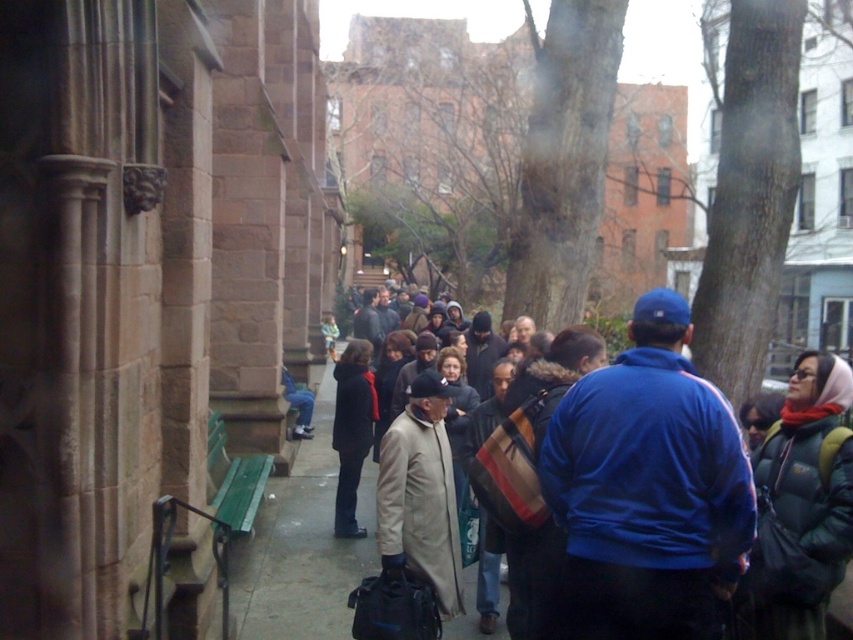
Does dark blue jacket at center have a lesser height compared to dark gray wool coat at center?

Incorrect, dark blue jacket at center's height does not fall short of dark gray wool coat at center's.

Is point (848, 520) positioned before point (352, 342)?

Yes.

Describe the element at coordinates (619, 481) in the screenshot. I see `dark blue jacket at center` at that location.

I want to click on dark blue jacket at center, so click(x=619, y=481).

Is light gray concrete sidewalk at center positioned at the back of dark gray wool coat at center?

No, light gray concrete sidewalk at center is in front of dark gray wool coat at center.

This screenshot has width=853, height=640. What are the coordinates of `light gray concrete sidewalk at center` in the screenshot? It's located at [305, 547].

Looking at this image, does dark blue jacket at center appear under light gray concrete sidewalk at center?

Actually, dark blue jacket at center is above light gray concrete sidewalk at center.

In the scene shown: Between dark blue jacket at center and light gray concrete sidewalk at center, which one appears on the right side from the viewer's perspective?

Positioned to the right is dark blue jacket at center.

Is point (695, 605) less distant than point (270, 582)?

That is True.

Find the location of a particular element. This screenshot has height=640, width=853. dark blue jacket at center is located at coordinates (619, 481).